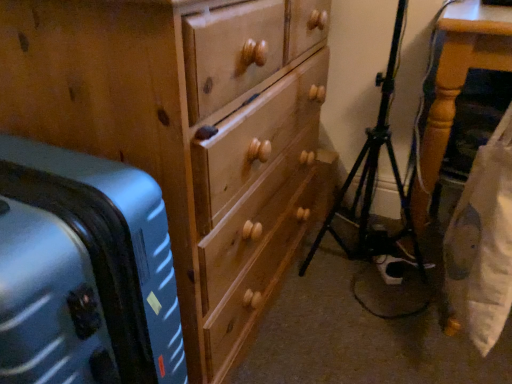
Question: From the image's perspective, is black metal tripod at lower right located above or below wooden chest of drawers at center?

Choices:
 (A) below
 (B) above

Answer: (A)

Question: Is black metal tripod at lower right taller or shorter than wooden chest of drawers at center?

Choices:
 (A) short
 (B) tall

Answer: (A)

Question: Based on their relative distances, which object is nearer to the metallic blue suitcase at left?

Choices:
 (A) wooden table at right
 (B) black metal tripod at lower right
 (C) wooden chest of drawers at center

Answer: (C)

Question: Considering the real-world distances, which object is farthest from the wooden chest of drawers at center?

Choices:
 (A) metallic blue suitcase at left
 (B) black metal tripod at lower right
 (C) wooden table at right

Answer: (C)